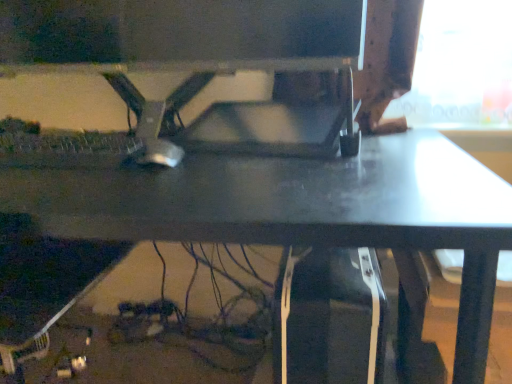
Question: Does matte black monitor at center have a larger size compared to matte black desk at center?

Choices:
 (A) yes
 (B) no

Answer: (B)

Question: From a real-world perspective, is matte black monitor at center located higher than matte black desk at center?

Choices:
 (A) no
 (B) yes

Answer: (B)

Question: From the image's perspective, is matte black monitor at center beneath matte black desk at center?

Choices:
 (A) yes
 (B) no

Answer: (B)

Question: Is matte black desk at center at the back of matte black monitor at center?

Choices:
 (A) no
 (B) yes

Answer: (A)

Question: Is matte black monitor at center positioned behind matte black desk at center?

Choices:
 (A) yes
 (B) no

Answer: (A)

Question: Is matte black monitor at center in front of or behind silver metallic mouse at center in the image?

Choices:
 (A) behind
 (B) front

Answer: (B)

Question: From the image's perspective, relative to silver metallic mouse at center, is matte black monitor at center above or below?

Choices:
 (A) above
 (B) below

Answer: (A)

Question: Visually, is matte black monitor at center positioned to the left or to the right of silver metallic mouse at center?

Choices:
 (A) right
 (B) left

Answer: (A)

Question: Is point (54, 66) positioned closer to the camera than point (168, 162)?

Choices:
 (A) farther
 (B) closer

Answer: (A)

Question: In the image, is matte black desk at center on the left side or the right side of silver metallic mouse at center?

Choices:
 (A) left
 (B) right

Answer: (A)

Question: Looking at their shapes, would you say matte black desk at center is wider or thinner than silver metallic mouse at center?

Choices:
 (A) wide
 (B) thin

Answer: (A)

Question: Looking at the image, does matte black desk at center seem bigger or smaller compared to silver metallic mouse at center?

Choices:
 (A) big
 (B) small

Answer: (A)

Question: Is matte black desk at center inside or outside of silver metallic mouse at center?

Choices:
 (A) outside
 (B) inside

Answer: (A)

Question: Is matte black monitor at center inside or outside of matte black desk at center?

Choices:
 (A) outside
 (B) inside

Answer: (A)

Question: From a real-world perspective, is matte black monitor at center physically located above or below matte black desk at center?

Choices:
 (A) below
 (B) above

Answer: (B)